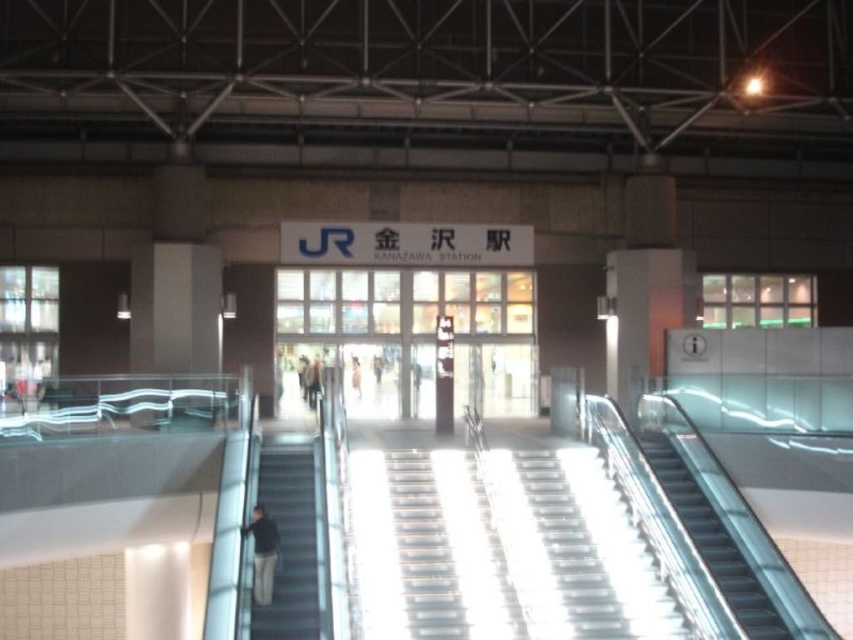
You are standing at the entrance of Kanazawa Station and need to reach the platform quickly. There is a metallic escalator at right and a dark gray jacket at lower left. Which direction should you head towards to reach the platform faster?

The metallic escalator at right is closer to the platform than the dark gray jacket at lower left, so you should head towards the metallic escalator at right to reach the platform faster.

You are at Kanazawa Station and need to carry a large piece of luggage that is 1.5 meters wide. You see the metallic escalator at right and the dark gray jacket at lower left. Which object can accommodate your luggage without it getting stuck?

The metallic escalator at right has a larger width than the dark gray jacket at lower left, so the luggage can fit on the metallic escalator at right.

You are standing at the entrance of Kanazawa Station and want to find the metallic gray escalator at lower left. According to the station layout, where should you look to find it?

The metallic gray escalator at lower left is located at point (289, 538) on the station layout.